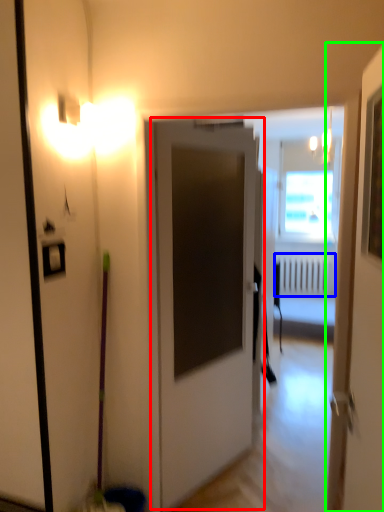
Question: Which is farther away from door (highlighted by a red box)? radiator (highlighted by a blue box) or door (highlighted by a green box)?

Choices:
 (A) radiator
 (B) door

Answer: (A)